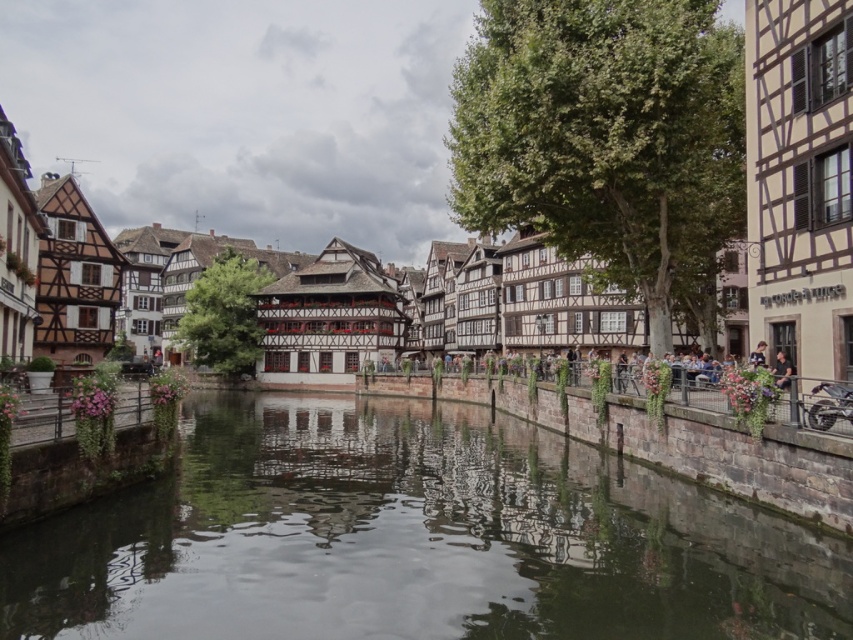
You are planning to take a photo of the smooth concrete river at center and brown timbered houses at center. Which one should you focus on if you want to capture the larger subject in your shot?

The brown timbered houses at center are larger than the smooth concrete river at center, so you should focus on the brown timbered houses at center to capture the larger subject.

You are a tourist standing on the bank of the canal and want to take a photo that includes both the smooth concrete river at center and the brown timbered houses at center. Which object should you position closer to the foreground to ensure both are clearly visible in your shot?

You should position the smooth concrete river at center closer to the foreground because it has a lesser height compared to the brown timbered houses at center, ensuring both are clearly visible in the photo.

You are a tourist in a historic European town and want to take a photo of the smooth concrete river at center and the brown timbered houses at center. Which one of these two objects appears narrower in the image?

The smooth concrete river at center appears narrower than the brown timbered houses at center in the image.